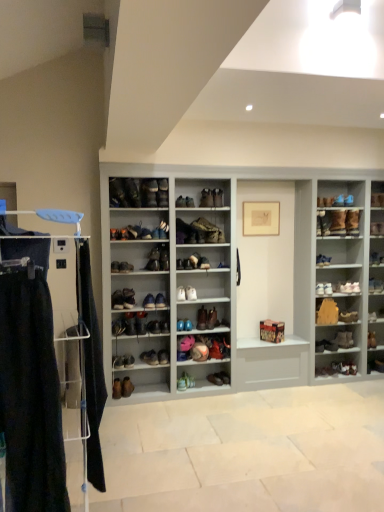
Question: Does shiny blue shoe at center right, positioned as the sixth shoe in right-to-left order, appear on the right side of dark blue fabric at left?

Choices:
 (A) no
 (B) yes

Answer: (B)

Question: Is shiny blue shoe at center right, marked as the twentieth shoe in a left-to-right arrangement, completely or partially outside of dark blue fabric at left?

Choices:
 (A) no
 (B) yes

Answer: (B)

Question: Is shiny blue shoe at center right, marked as the twentieth shoe in a left-to-right arrangement, behind dark blue fabric at left?

Choices:
 (A) no
 (B) yes

Answer: (B)

Question: Is the position of shiny blue shoe at center right, marked as the twentieth shoe in a left-to-right arrangement, less distant than that of dark blue fabric at left?

Choices:
 (A) yes
 (B) no

Answer: (B)

Question: Considering the relative sizes of shiny blue shoe at center right, marked as the twentieth shoe in a left-to-right arrangement, and dark blue fabric at left in the image provided, is shiny blue shoe at center right, marked as the twentieth shoe in a left-to-right arrangement, taller than dark blue fabric at left?

Choices:
 (A) no
 (B) yes

Answer: (A)

Question: Is point (145, 196) closer or farther from the camera than point (162, 321)?

Choices:
 (A) closer
 (B) farther

Answer: (A)

Question: Do you think leather boot at center, which ranks as the 6th shoe in left-to-right order, is within shiny blue shoe at center, the ninth shoe positioned from the left, or outside of it?

Choices:
 (A) outside
 (B) inside

Answer: (A)

Question: Considering the positions of leather boot at center, marked as the twentieth shoe in a right-to-left arrangement, and shiny blue shoe at center, the seventeenth shoe positioned from the right, in the image, is leather boot at center, marked as the twentieth shoe in a right-to-left arrangement, taller or shorter than shiny blue shoe at center, the seventeenth shoe positioned from the right,?

Choices:
 (A) short
 (B) tall

Answer: (B)

Question: From a real-world perspective, is leather boot at center, marked as the twentieth shoe in a right-to-left arrangement, above or below shiny blue shoe at center, the seventeenth shoe positioned from the right?

Choices:
 (A) above
 (B) below

Answer: (A)

Question: Is point (200, 217) positioned closer to the camera than point (331, 219)?

Choices:
 (A) closer
 (B) farther

Answer: (A)

Question: In terms of width, does leather boot at center, arranged as the seventh footwear when ordered from the bottom, look wider or thinner when compared to brown suede boot at upper right, which appears as the fifth shoe when viewed from the right?

Choices:
 (A) thin
 (B) wide

Answer: (B)

Question: Is leather boot at center, which is counted as the first footwear, starting from the top, spatially inside brown suede boot at upper right, placed as the 21th shoe when sorted from left to right, or outside of it?

Choices:
 (A) outside
 (B) inside

Answer: (A)

Question: Considering the positions of leather boot at center, which is counted as the first footwear, starting from the top, and brown suede boot at upper right, which appears as the fifth shoe when viewed from the right, in the image, is leather boot at center, which is counted as the first footwear, starting from the top, taller or shorter than brown suede boot at upper right, which appears as the fifth shoe when viewed from the right,?

Choices:
 (A) tall
 (B) short

Answer: (B)

Question: From the image's perspective, is leather shoe at center, the 19th shoe when ordered from right to left, above or below shiny leather sneaker at center, which is the 21th shoe in right-to-left order?

Choices:
 (A) above
 (B) below

Answer: (B)

Question: Is point (152, 325) positioned closer to the camera than point (142, 318)?

Choices:
 (A) closer
 (B) farther

Answer: (B)